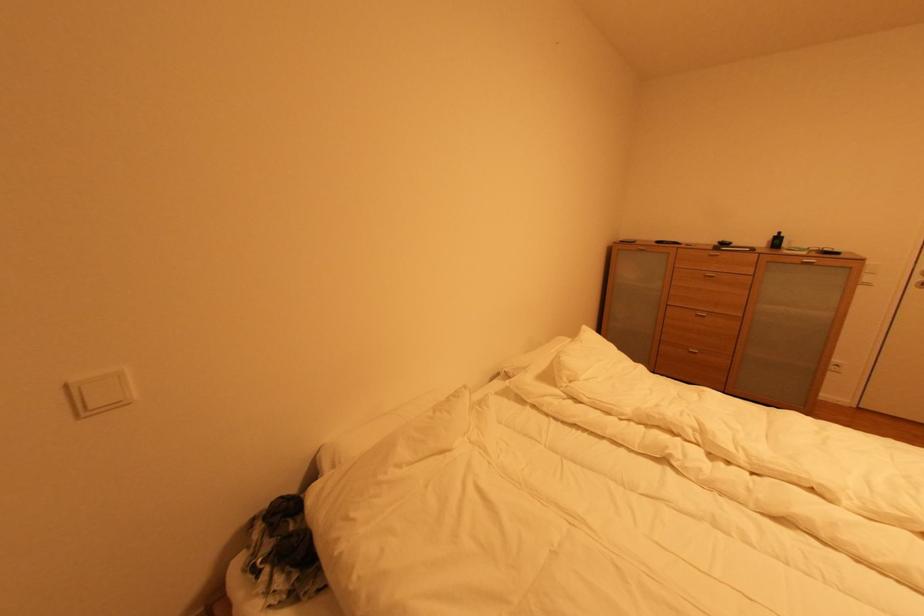
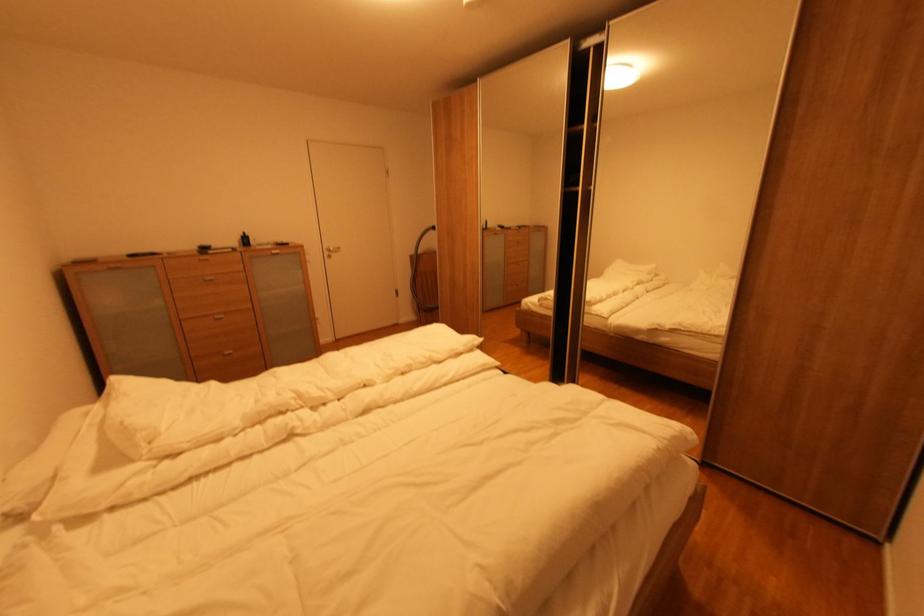
Where in the second image is the point corresponding to pixel 783 236 from the first image?

(248, 237)